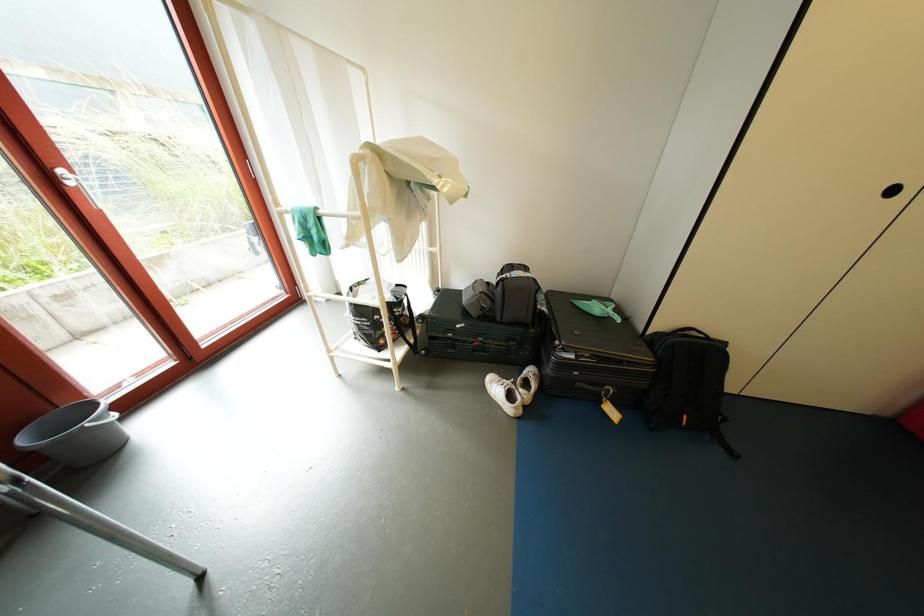
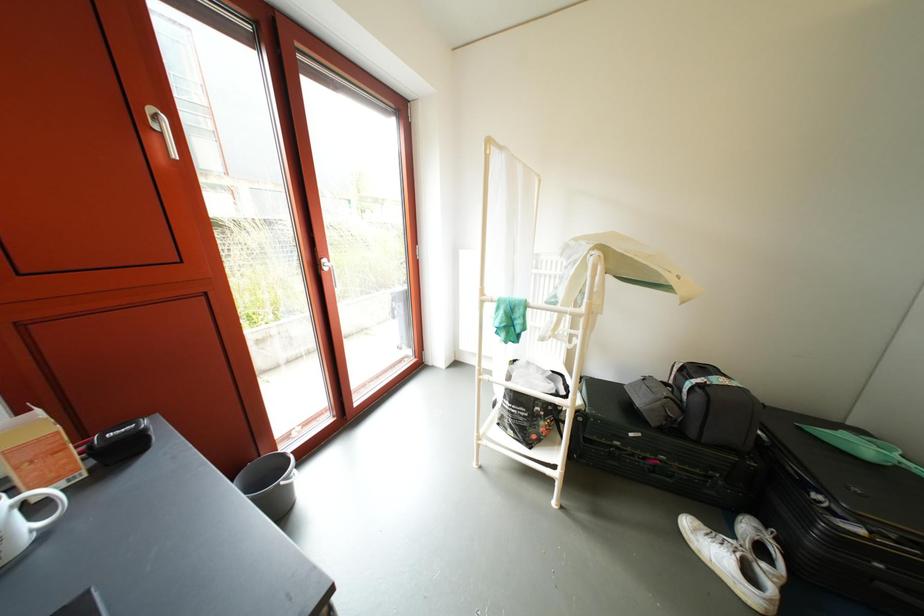
Question: What movement of the cameraman would produce the second image?

Choices:
 (A) Left
 (B) Right
 (C) Forward
 (D) Backward

Answer: (A)